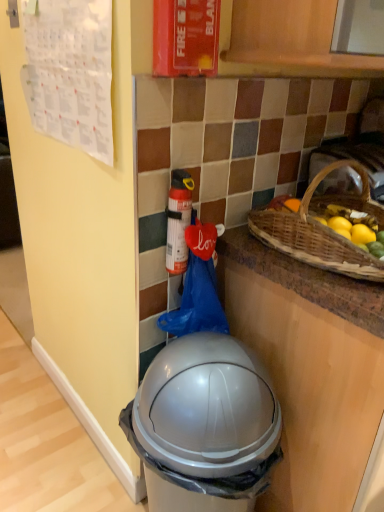
Question: Considering the relative sizes of red matte fire extinguisher at center and silver plastic trash can at lower center in the image provided, is red matte fire extinguisher at center thinner than silver plastic trash can at lower center?

Choices:
 (A) yes
 (B) no

Answer: (A)

Question: From the image's perspective, is red matte fire extinguisher at center located above silver plastic trash can at lower center?

Choices:
 (A) no
 (B) yes

Answer: (B)

Question: Is red matte fire extinguisher at center completely or partially outside of silver plastic trash can at lower center?

Choices:
 (A) yes
 (B) no

Answer: (A)

Question: Is red matte fire extinguisher at center at the left side of silver plastic trash can at lower center?

Choices:
 (A) yes
 (B) no

Answer: (A)

Question: From a real-world perspective, is red matte fire extinguisher at center positioned over silver plastic trash can at lower center based on gravity?

Choices:
 (A) yes
 (B) no

Answer: (A)

Question: Relative to brown woven picnic basket at upper right, is silver plastic trash can at lower center in front or behind?

Choices:
 (A) behind
 (B) front

Answer: (B)

Question: In terms of size, does silver plastic trash can at lower center appear bigger or smaller than brown woven picnic basket at upper right?

Choices:
 (A) big
 (B) small

Answer: (A)

Question: Is silver plastic trash can at lower center wider or thinner than brown woven picnic basket at upper right?

Choices:
 (A) thin
 (B) wide

Answer: (A)

Question: From a real-world perspective, is silver plastic trash can at lower center above or below brown woven picnic basket at upper right?

Choices:
 (A) above
 (B) below

Answer: (B)

Question: Considering the positions of red matte fire extinguisher at upper center and silver plastic trash can at lower center in the image, is red matte fire extinguisher at upper center taller or shorter than silver plastic trash can at lower center?

Choices:
 (A) tall
 (B) short

Answer: (B)

Question: Is point (188, 23) positioned closer to the camera than point (266, 407)?

Choices:
 (A) closer
 (B) farther

Answer: (A)

Question: Relative to silver plastic trash can at lower center, is red matte fire extinguisher at upper center in front or behind?

Choices:
 (A) front
 (B) behind

Answer: (B)

Question: Looking at their shapes, would you say red matte fire extinguisher at upper center is wider or thinner than silver plastic trash can at lower center?

Choices:
 (A) thin
 (B) wide

Answer: (A)

Question: From a real-world perspective, is red matte fire extinguisher at upper center above or below red matte fire extinguisher at center?

Choices:
 (A) below
 (B) above

Answer: (B)

Question: Is red matte fire extinguisher at upper center in front of or behind red matte fire extinguisher at center in the image?

Choices:
 (A) front
 (B) behind

Answer: (A)